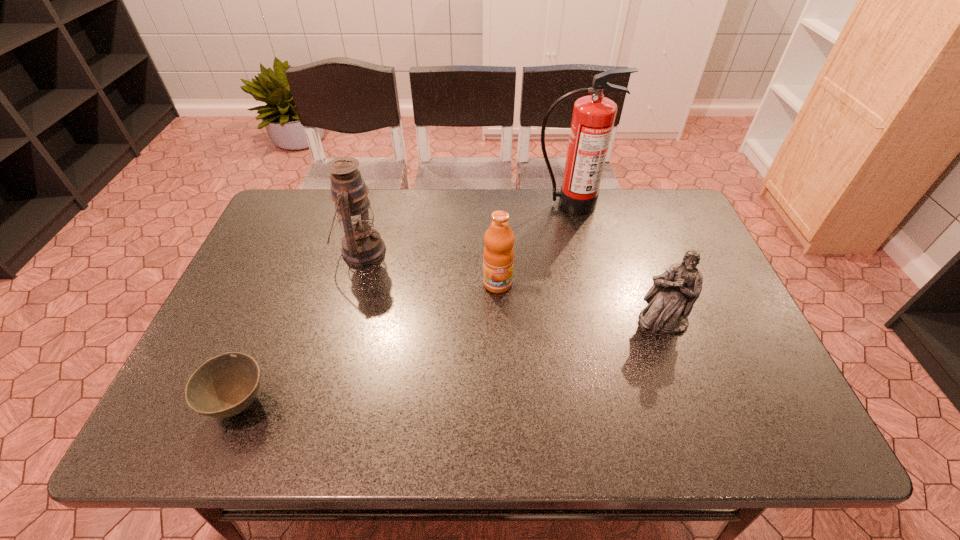
At what (x,y) coordinates should I click in order to perform the action: click on the farthest object. Please return your answer as a coordinate pair (x, y). The image size is (960, 540). Looking at the image, I should click on (593, 118).

Find the location of a particular element. This screenshot has height=540, width=960. fire extinguisher is located at coordinates (593, 118).

The height and width of the screenshot is (540, 960). Find the location of `the fourth shortest object`. the fourth shortest object is located at coordinates (361, 245).

The image size is (960, 540). Identify the location of the fourth object from right to left. (361, 245).

At what (x,y) coordinates should I click in order to perform the action: click on fruit juice. Please return your answer as a coordinate pair (x, y). The height and width of the screenshot is (540, 960). Looking at the image, I should click on (498, 255).

The width and height of the screenshot is (960, 540). Find the location of `the fourth farthest object`. the fourth farthest object is located at coordinates (670, 300).

In order to click on bowl in this screenshot , I will do `click(225, 385)`.

The height and width of the screenshot is (540, 960). Identify the location of the shortest object. (225, 385).

The width and height of the screenshot is (960, 540). I want to click on vacant region located on the front-facing side of the tallest object, so click(577, 238).

You are a GUI agent. You are given a task and a screenshot of the screen. Output one action in this format:
    pyautogui.click(x=<x>, y=<y>)
    Task: Click on the vacant space located 0.150m on the left of the oil lamp
    This screenshot has width=960, height=540.
    Given the screenshot: What is the action you would take?
    pyautogui.click(x=285, y=251)